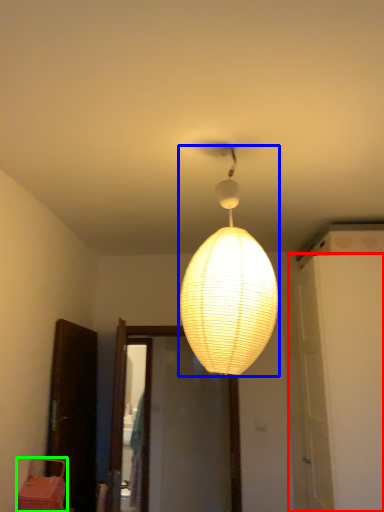
Question: Which object is the farthest from door (highlighted by a red box)? Choose among these: lamp (highlighted by a blue box) or furniture (highlighted by a green box).

Choices:
 (A) lamp
 (B) furniture

Answer: (B)